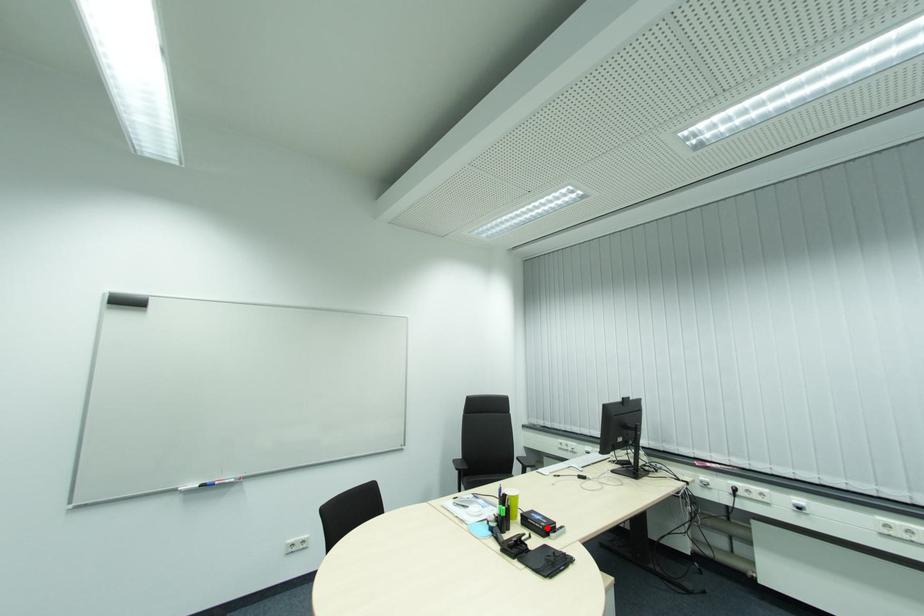
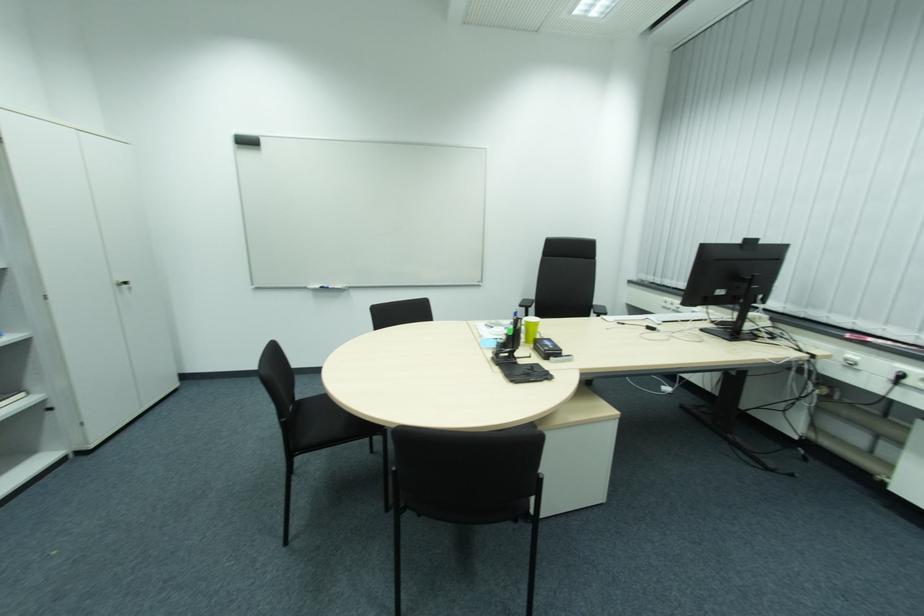
Where in the second image is the point corresponding to the highlighted location from the first image?

(550, 351)